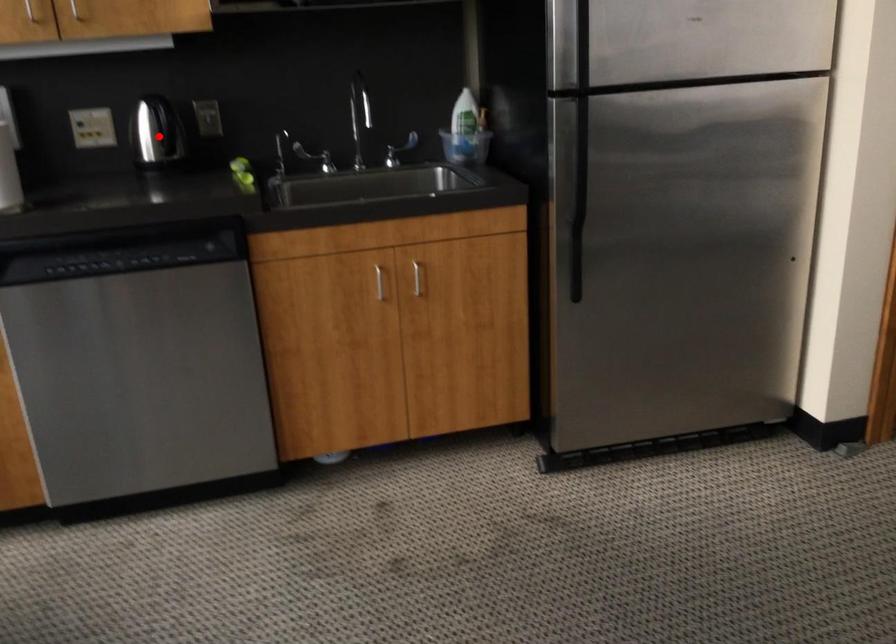
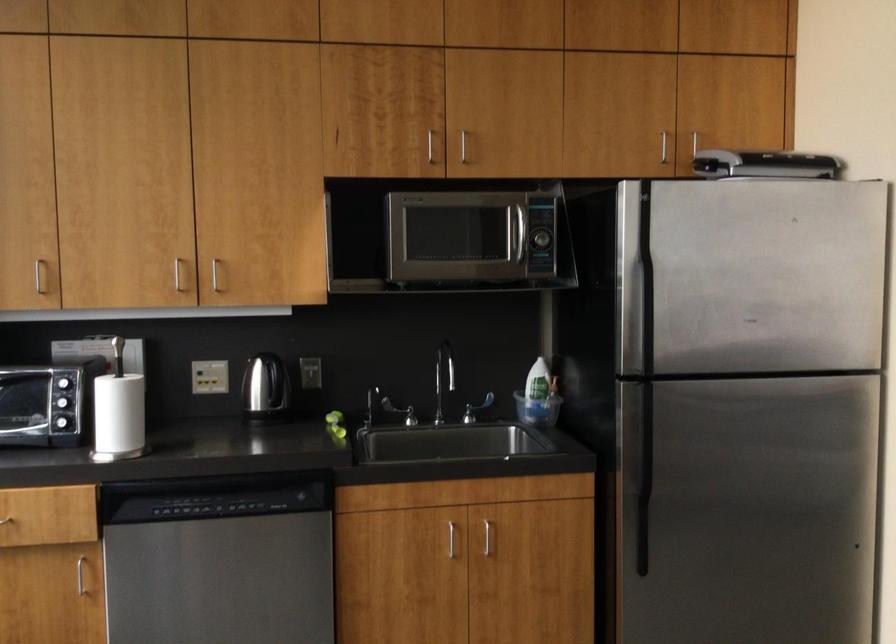
Where in the second image is the point corresponding to the highlighted location from the first image?

(266, 391)